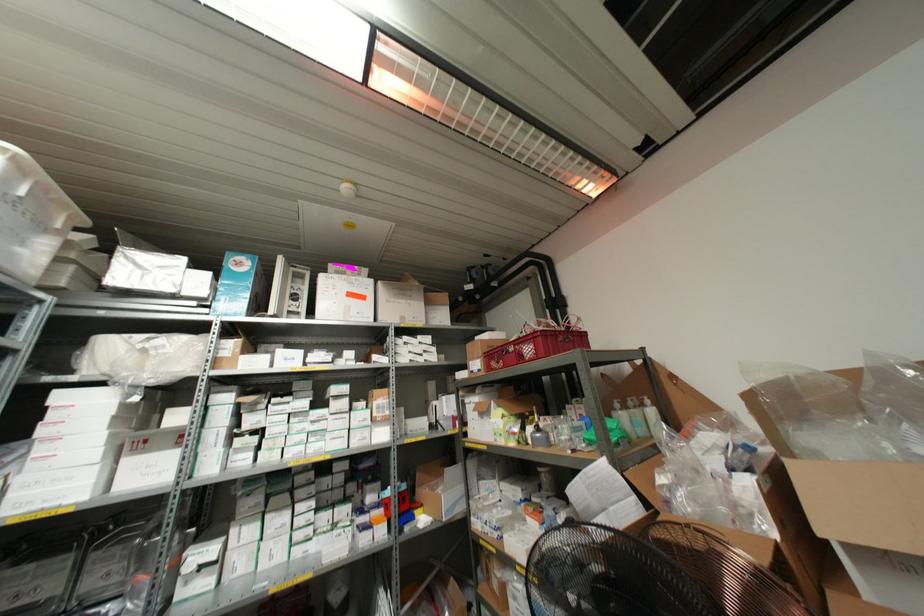
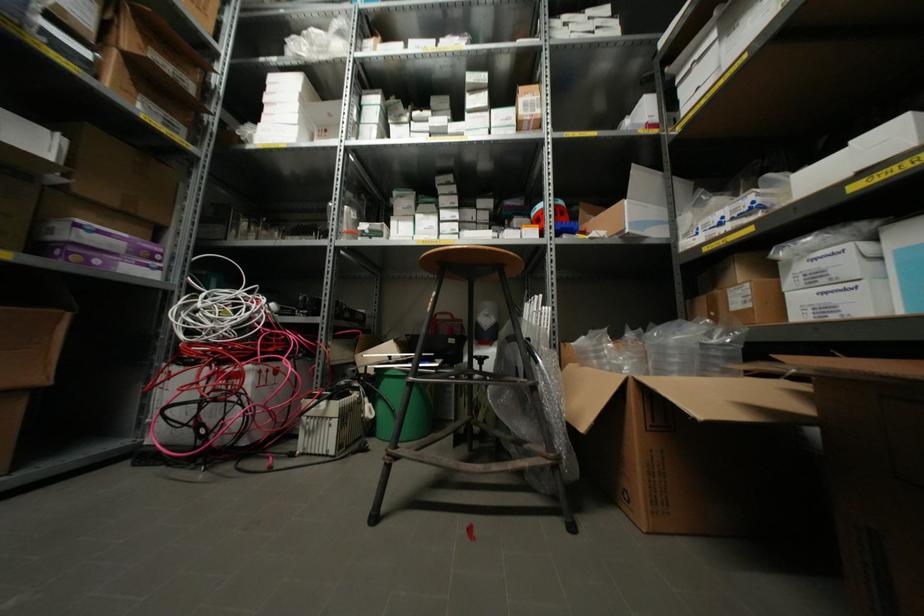
The point at (61, 395) is marked in the first image. Where is the corresponding point in the second image?

(272, 79)